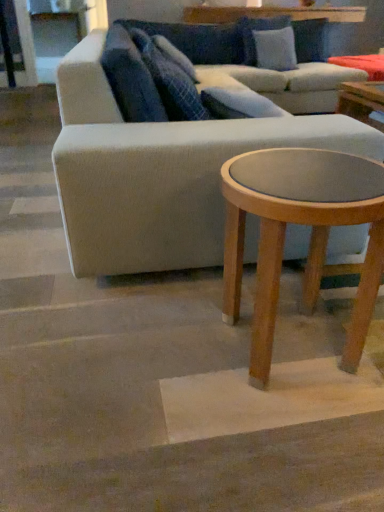
What is the approximate width of light blue fabric pillow at upper center, which ranks as the third pillow in bottom-to-top order?

It is 25.74 centimeters.

Image resolution: width=384 pixels, height=512 pixels. What are the coordinates of `light gray fabric couch at center` in the screenshot? It's located at (158, 173).

In order to face light gray fabric couch at center, should I rotate leftwards or rightwards?

Rotate right and turn 9.167 degrees.

What do you see at coordinates (310, 239) in the screenshot?
I see `light brown wood coffee table at lower right` at bounding box center [310, 239].

Locate an element on the screen. The image size is (384, 512). blue textured pillow at upper center, placed as the 1th pillow when sorted from left to right is located at coordinates (130, 78).

You are a GUI agent. You are given a task and a screenshot of the screen. Output one action in this format:
    pyautogui.click(x=<x>, y=<y>)
    Task: Click on the 1st pillow located above the light brown wood coffee table at lower right (from a real-world perspective)
    The image size is (384, 512).
    Given the screenshot: What is the action you would take?
    pyautogui.click(x=130, y=78)

Considering the relative sizes of blue textured pillow at upper center, arranged as the 3th pillow when viewed from the back, and light brown wood coffee table at lower right in the image provided, is blue textured pillow at upper center, arranged as the 3th pillow when viewed from the back, thinner than light brown wood coffee table at lower right?

Yes, blue textured pillow at upper center, arranged as the 3th pillow when viewed from the back, is thinner than light brown wood coffee table at lower right.

Is blue textured pillow at upper center, marked as the first pillow in a front-to-back arrangement, positioned far away from light brown wood coffee table at lower right?

No.

Considering their positions, is blue textured pillow at upper center, the second pillow positioned from the top, located in front of or behind light brown wood coffee table at lower right?

blue textured pillow at upper center, the second pillow positioned from the top, is positioned farther from the viewer than light brown wood coffee table at lower right.

Consider the image. Can you confirm if light brown wood coffee table at lower right is taller than light gray fabric couch at center?

Incorrect, the height of light brown wood coffee table at lower right is not larger of that of light gray fabric couch at center.

From the image's perspective, is light brown wood coffee table at lower right located above light gray fabric couch at center?

Incorrect, from the image's perspective, light brown wood coffee table at lower right is lower than light gray fabric couch at center.

Could light gray fabric couch at center be considered to be inside light brown wood coffee table at lower right?

No, light gray fabric couch at center is located outside of light brown wood coffee table at lower right.

Which object is more forward, light brown wood coffee table at lower right or light gray fabric couch at center?

light brown wood coffee table at lower right is closer to the camera.

Could you tell me if light gray fabric couch at center is facing blue textured pillow at upper center, arranged as the third pillow when viewed from the right?

No, light gray fabric couch at center is not oriented towards blue textured pillow at upper center, arranged as the third pillow when viewed from the right.

From the image's perspective, is light gray fabric couch at center over blue textured pillow at upper center, arranged as the third pillow when viewed from the right?

Yes.

Measure the distance from light gray fabric couch at center to blue textured pillow at upper center, the second pillow when ordered from bottom to top.

They are 10.20 inches apart.

Can you tell me how much light gray fabric couch at center and blue textured pillow at upper center, arranged as the 3th pillow when viewed from the back, differ in facing direction?

light gray fabric couch at center and blue textured pillow at upper center, arranged as the 3th pillow when viewed from the back, are facing 0.443 degrees away from each other.

Is light brown wood coffee table at lower right in front of blue textured pillow at upper center, placed as the second pillow when sorted from front to back?

Yes, it is in front of blue textured pillow at upper center, placed as the second pillow when sorted from front to back.

Which point is more distant from viewer, (277, 196) or (130, 28)?

Point (130, 28)

From a real-world perspective, is light brown wood coffee table at lower right physically above blue textured pillow at upper center, acting as the second pillow starting from the right?

No, from a real-world perspective, light brown wood coffee table at lower right is not on top of blue textured pillow at upper center, acting as the second pillow starting from the right.

Does light brown wood coffee table at lower right have a smaller size compared to blue textured pillow at upper center, placed as the 3th pillow when sorted from top to bottom?

No, light brown wood coffee table at lower right is not smaller than blue textured pillow at upper center, placed as the 3th pillow when sorted from top to bottom.

Does light gray fabric couch at center have a lesser height compared to light blue fabric pillow at upper center, acting as the first pillow starting from the back?

In fact, light gray fabric couch at center may be taller than light blue fabric pillow at upper center, acting as the first pillow starting from the back.

From a real-world perspective, which object rests below the other?

From a 3D spatial view, light gray fabric couch at center is below.

Is light gray fabric couch at center to the right of light blue fabric pillow at upper center, acting as the third pillow starting from the front, from the viewer's perspective?

In fact, light gray fabric couch at center is to the left of light blue fabric pillow at upper center, acting as the third pillow starting from the front.

Consider the image. Which of these two, light gray fabric couch at center or light blue fabric pillow at upper center, the first pillow when ordered from top to bottom, is wider?

light gray fabric couch at center is wider.

Is blue textured pillow at upper center, the second pillow when ordered from bottom to top, far from blue textured pillow at upper center, which is the 2th pillow from left to right?

blue textured pillow at upper center, the second pillow when ordered from bottom to top, is actually quite close to blue textured pillow at upper center, which is the 2th pillow from left to right.

Which of these two, blue textured pillow at upper center, the second pillow when ordered from bottom to top, or blue textured pillow at upper center, acting as the 1th pillow starting from the bottom, stands shorter?

With less height is blue textured pillow at upper center, acting as the 1th pillow starting from the bottom.

What's the angular difference between blue textured pillow at upper center, arranged as the third pillow when viewed from the right, and blue textured pillow at upper center, acting as the second pillow starting from the right,'s facing directions?

The angular difference between blue textured pillow at upper center, arranged as the third pillow when viewed from the right, and blue textured pillow at upper center, acting as the second pillow starting from the right, is 0.00019 degrees.

Looking at this image, is blue textured pillow at upper center, the second pillow positioned from the top, in front of blue textured pillow at upper center, acting as the 1th pillow starting from the bottom?

Yes, blue textured pillow at upper center, the second pillow positioned from the top, is in front of blue textured pillow at upper center, acting as the 1th pillow starting from the bottom.

Consider the image. Which of these two, blue textured pillow at upper center, acting as the 1th pillow starting from the bottom, or light blue fabric pillow at upper center, acting as the first pillow starting from the back, stands taller?

Standing taller between the two is light blue fabric pillow at upper center, acting as the first pillow starting from the back.

From the image's perspective, which one is positioned higher, blue textured pillow at upper center, the second pillow when ordered from back to front, or light blue fabric pillow at upper center, acting as the first pillow starting from the back?

light blue fabric pillow at upper center, acting as the first pillow starting from the back, is shown above in the image.

Is blue textured pillow at upper center, placed as the 3th pillow when sorted from top to bottom, directly adjacent to light blue fabric pillow at upper center, acting as the third pillow starting from the front?

No, blue textured pillow at upper center, placed as the 3th pillow when sorted from top to bottom, is not touching light blue fabric pillow at upper center, acting as the third pillow starting from the front.

From a real-world perspective, which object rests below the other?

light blue fabric pillow at upper center, acting as the first pillow starting from the back.

This screenshot has height=512, width=384. I want to click on coffee table that is below the blue textured pillow at upper center, placed as the 1th pillow when sorted from left to right (from the image's perspective), so click(310, 239).

Locate an element on the screen. The height and width of the screenshot is (512, 384). studio couch positioned vertically above the light brown wood coffee table at lower right (from a real-world perspective) is located at coordinates (158, 173).

From the image, which object appears to be farther from blue textured pillow at upper center, placed as the second pillow when sorted from front to back, light blue fabric pillow at upper center, acting as the first pillow starting from the back, or light gray fabric couch at center?

light blue fabric pillow at upper center, acting as the first pillow starting from the back, is further to blue textured pillow at upper center, placed as the second pillow when sorted from front to back.

Based on their spatial positions, is blue textured pillow at upper center, the second pillow positioned from the top, or light brown wood coffee table at lower right closer to light gray fabric couch at center?

blue textured pillow at upper center, the second pillow positioned from the top, lies closer to light gray fabric couch at center than the other object.

When comparing their distances from light brown wood coffee table at lower right, does blue textured pillow at upper center, arranged as the third pillow when viewed from the right, or light gray fabric couch at center seem closer?

Based on the image, light gray fabric couch at center appears to be nearer to light brown wood coffee table at lower right.

When comparing their distances from light blue fabric pillow at upper center, the 3th pillow from the left, does light gray fabric couch at center or light brown wood coffee table at lower right seem closer?

light gray fabric couch at center.

Based on their spatial positions, is light brown wood coffee table at lower right or light gray fabric couch at center further from blue textured pillow at upper center, the second pillow when ordered from back to front?

Based on the image, light brown wood coffee table at lower right appears to be further to blue textured pillow at upper center, the second pillow when ordered from back to front.

When comparing their distances from blue textured pillow at upper center, the second pillow when ordered from bottom to top, does blue textured pillow at upper center, the second pillow when ordered from back to front, or light blue fabric pillow at upper center, the 3th pillow from the left, seem closer?

blue textured pillow at upper center, the second pillow when ordered from back to front, is closer to blue textured pillow at upper center, the second pillow when ordered from bottom to top.

Looking at the image, which one is located further to light gray fabric couch at center, light blue fabric pillow at upper center, the 3th pillow from the left, or light brown wood coffee table at lower right?

light blue fabric pillow at upper center, the 3th pillow from the left, is positioned further to the anchor light gray fabric couch at center.

When comparing their distances from light blue fabric pillow at upper center, which ranks as the third pillow in bottom-to-top order, does blue textured pillow at upper center, arranged as the 3th pillow when viewed from the back, or blue textured pillow at upper center, the second pillow when ordered from back to front, seem closer?

blue textured pillow at upper center, the second pillow when ordered from back to front, is positioned closer to the anchor light blue fabric pillow at upper center, which ranks as the third pillow in bottom-to-top order.

Find the location of `pillow between blue textured pillow at upper center, arranged as the 3th pillow when viewed from the back, and light blue fabric pillow at upper center, acting as the first pillow starting from the back, in the front-back direction`. pillow between blue textured pillow at upper center, arranged as the 3th pillow when viewed from the back, and light blue fabric pillow at upper center, acting as the first pillow starting from the back, in the front-back direction is located at coordinates (171, 76).

At what (x,y) coordinates should I click in order to perform the action: click on studio couch located between light brown wood coffee table at lower right and light blue fabric pillow at upper center, acting as the third pillow starting from the front, in the depth direction. Please return your answer as a coordinate pair (x, y). This screenshot has width=384, height=512. Looking at the image, I should click on (158, 173).

This screenshot has width=384, height=512. Find the location of `pillow between blue textured pillow at upper center, arranged as the third pillow when viewed from the right, and light gray fabric couch at center`. pillow between blue textured pillow at upper center, arranged as the third pillow when viewed from the right, and light gray fabric couch at center is located at coordinates point(171,76).

The image size is (384, 512). Identify the location of pillow between blue textured pillow at upper center, placed as the 1th pillow when sorted from left to right, and light brown wood coffee table at lower right vertically. (171, 76).